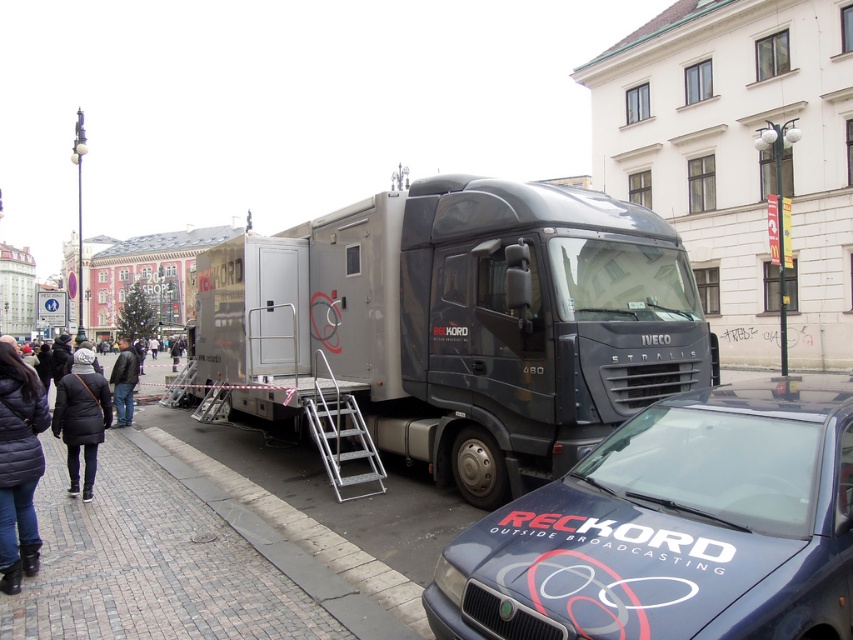
Can you confirm if metallic silver trailer truck at center is bigger than metallic silver ladder at center?

Indeed, metallic silver trailer truck at center has a larger size compared to metallic silver ladder at center.

Does point (474, 289) come closer to viewer compared to point (343, 442)?

Yes.

The image size is (853, 640). I want to click on metallic silver trailer truck at center, so click(460, 323).

Measure the distance between point (x=555, y=618) and camera.

Point (x=555, y=618) is 2.84 meters away from camera.

This screenshot has width=853, height=640. I want to click on matte black van at center, so click(x=672, y=529).

Does metallic silver trailer truck at center have a greater width compared to leather jacket at lower left?

No, metallic silver trailer truck at center is not wider than leather jacket at lower left.

Can you confirm if metallic silver trailer truck at center is smaller than leather jacket at lower left?

Correct, metallic silver trailer truck at center occupies less space than leather jacket at lower left.

Identify the location of metallic silver trailer truck at center. (460, 323).